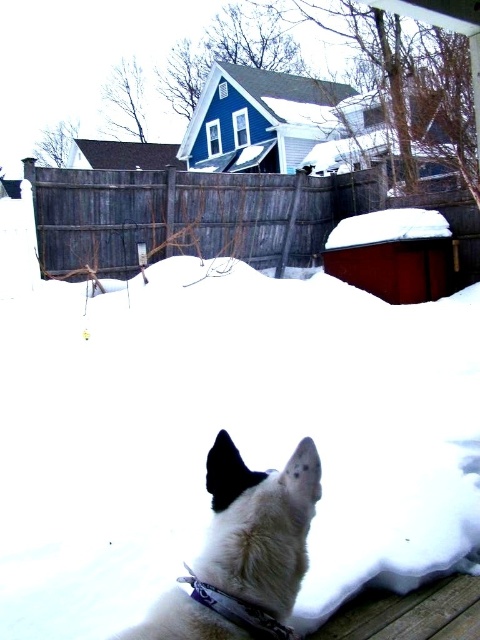
Question: Is white fluffy snow at center to the right of white matte dog at lower center from the viewer's perspective?

Choices:
 (A) no
 (B) yes

Answer: (B)

Question: Estimate the real-world distances between objects in this image. Which object is closer to the purple fabric neckband at lower center?

Choices:
 (A) white matte dog at lower center
 (B) white fluffy snow at center

Answer: (A)

Question: Can you confirm if white fluffy snow at center is positioned to the left of white matte dog at lower center?

Choices:
 (A) yes
 (B) no

Answer: (B)

Question: Which point appears farthest from the camera in this image?

Choices:
 (A) (427, 609)
 (B) (183, 448)
 (C) (269, 632)

Answer: (B)

Question: Among these objects, which one is farthest from the camera?

Choices:
 (A) wooden at lower right
 (B) purple fabric neckband at lower center
 (C) white matte dog at lower center
 (D) white fluffy snow at center

Answer: (D)

Question: Can you confirm if white matte dog at lower center is positioned above purple fabric neckband at lower center?

Choices:
 (A) no
 (B) yes

Answer: (B)